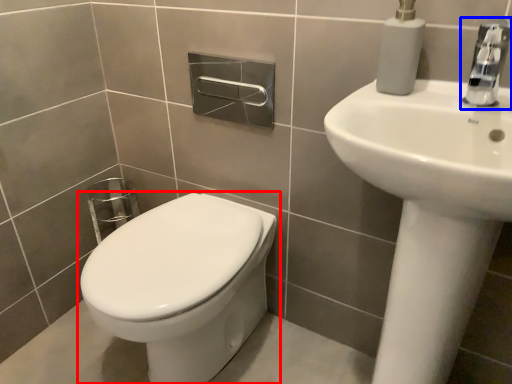
Question: Which of the following is the farthest to the observer, toilet (highlighted by a red box) or tap (highlighted by a blue box)?

Choices:
 (A) toilet
 (B) tap

Answer: (A)